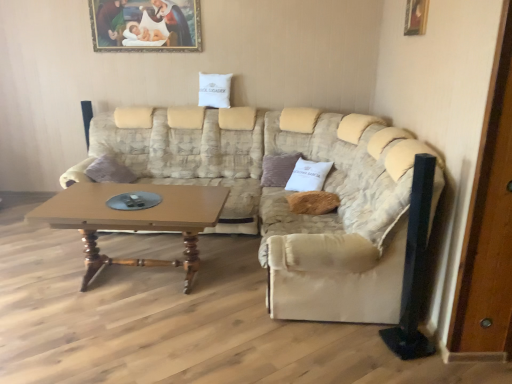
The width and height of the screenshot is (512, 384). In order to click on free space in front of wooden polished coffee table at center in this screenshot , I will do `click(147, 341)`.